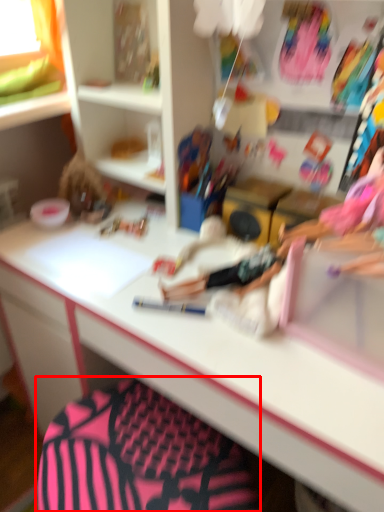
Question: From the image, what is the correct spatial relationship of swivel chair (annotated by the red box) in relation to desk?

Choices:
 (A) right
 (B) left

Answer: (B)